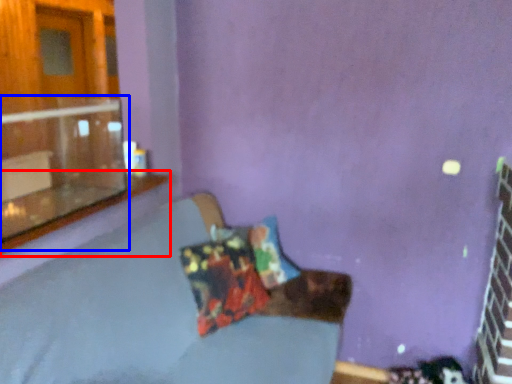
Question: Which object appears closest to the camera in this image, window sill (highlighted by a red box) or window (highlighted by a blue box)?

Choices:
 (A) window sill
 (B) window

Answer: (B)